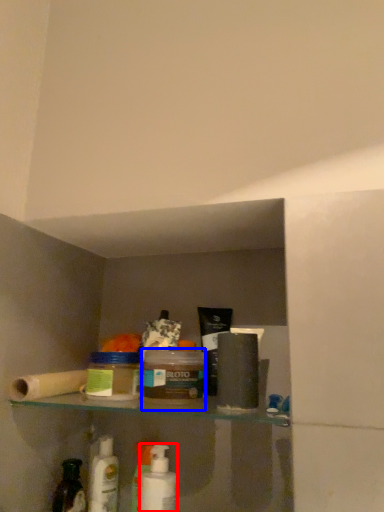
Question: Which object appears closest to the camera in this image, mouthwash (highlighted by a red box) or product (highlighted by a blue box)?

Choices:
 (A) mouthwash
 (B) product

Answer: (B)